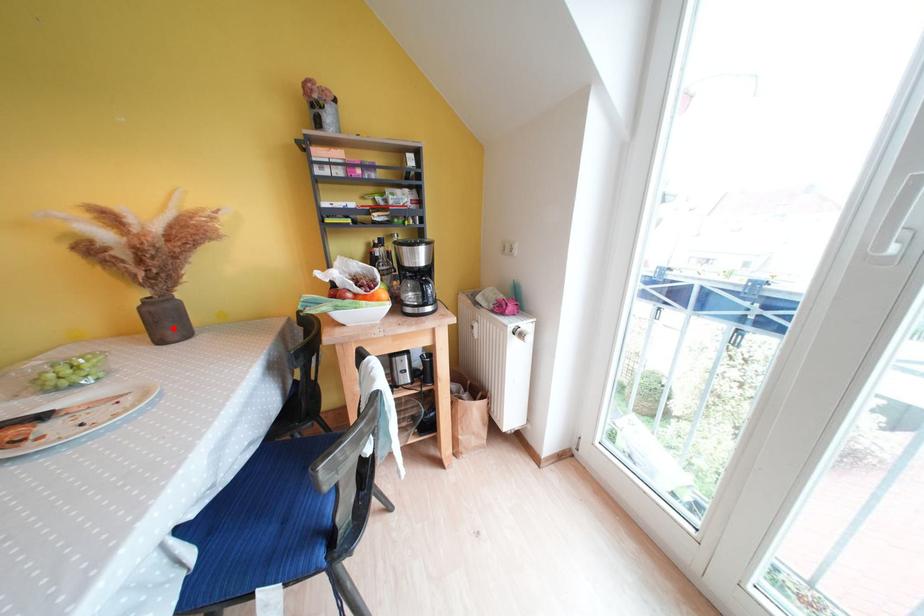
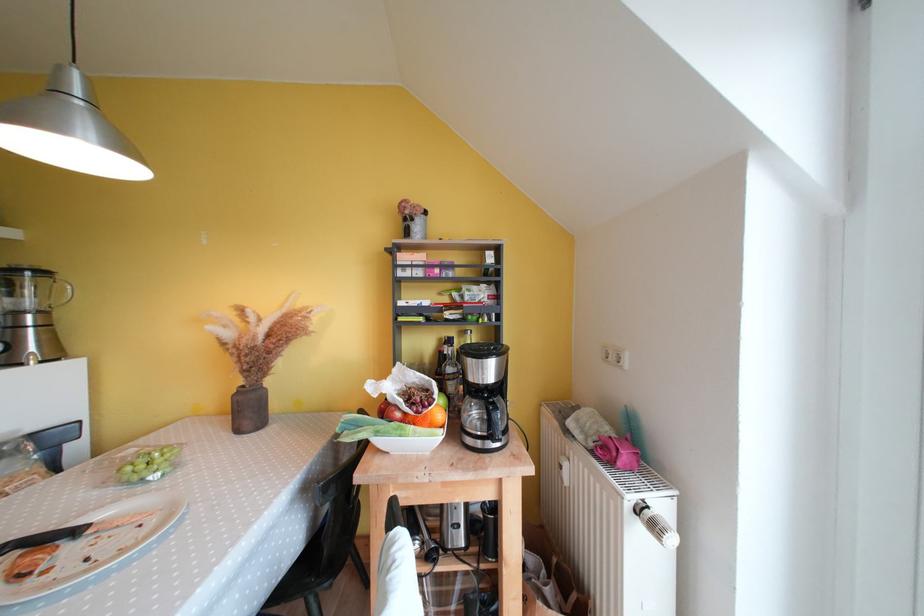
Find the pixel in the second image that matches the highlighted location in the first image.

(256, 416)